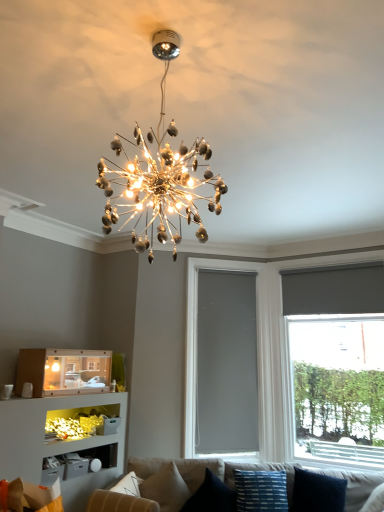
Question: From a real-world perspective, is shiny metallic chandelier at center positioned above or below matte gray roller shade at right?

Choices:
 (A) above
 (B) below

Answer: (A)

Question: Based on their sizes in the image, would you say shiny metallic chandelier at center is bigger or smaller than matte gray roller shade at right?

Choices:
 (A) small
 (B) big

Answer: (A)

Question: Which is farther from the beige fabric couch at lower center?

Choices:
 (A) velvet blue pillow at lower center, the third pillow from the right
 (B) dark blue fabric pillow at lower right, which is the fourth pillow from left to right
 (C) gray matte window screen at center
 (D) matte gray roller shade at right
 (E) shiny metallic chandelier at center

Answer: (E)

Question: Estimate the real-world distances between objects in this image. Which object is farther from the matte cardboard shelf at lower left?

Choices:
 (A) velvet blue pillow at lower center, which appears as the 2th pillow when viewed from the left
 (B) beige fabric couch at lower center
 (C) blue striped fabric pillow at lower center, the second pillow viewed from the right
 (D) beige fabric pillow at lower center, positioned as the first pillow in left-to-right order
 (E) dark blue fabric pillow at lower right, the 1th pillow when ordered from right to left

Answer: (E)